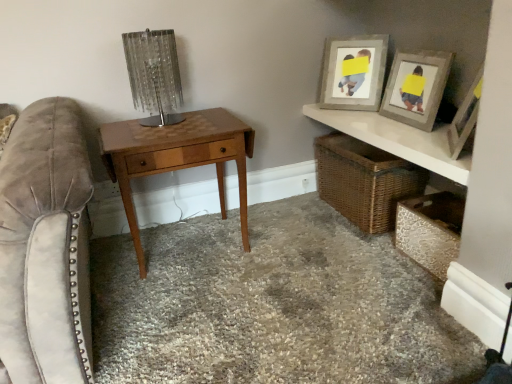
Question: Is carpeted floor at center bigger or smaller than metallic textured chest at lower right, which is counted as the first shelf, starting from the bottom?

Choices:
 (A) small
 (B) big

Answer: (B)

Question: Do you think carpeted floor at center is within metallic textured chest at lower right, which is counted as the first shelf, starting from the bottom, or outside of it?

Choices:
 (A) outside
 (B) inside

Answer: (A)

Question: Which of these objects is positioned closest to the suede swivel chair at left?

Choices:
 (A) wooden picture frame at upper right, the first picture frame in the front-to-back sequence
 (B) metallic textured chest at lower right, the second shelf positioned from the top
 (C) white glossy shelf at upper right, which ranks as the second shelf in bottom-to-top order
 (D) clear glass table lamp at upper left
 (E) light brown wood table at center

Answer: (E)

Question: Considering the real-world distances, which object is closest to the light brown wood table at center?

Choices:
 (A) wooden picture frame at upper right, the first picture frame in the front-to-back sequence
 (B) suede swivel chair at left
 (C) wooden picture frame at upper right, the 1th picture frame positioned from the back
 (D) clear glass table lamp at upper left
 (E) carpeted floor at center

Answer: (D)